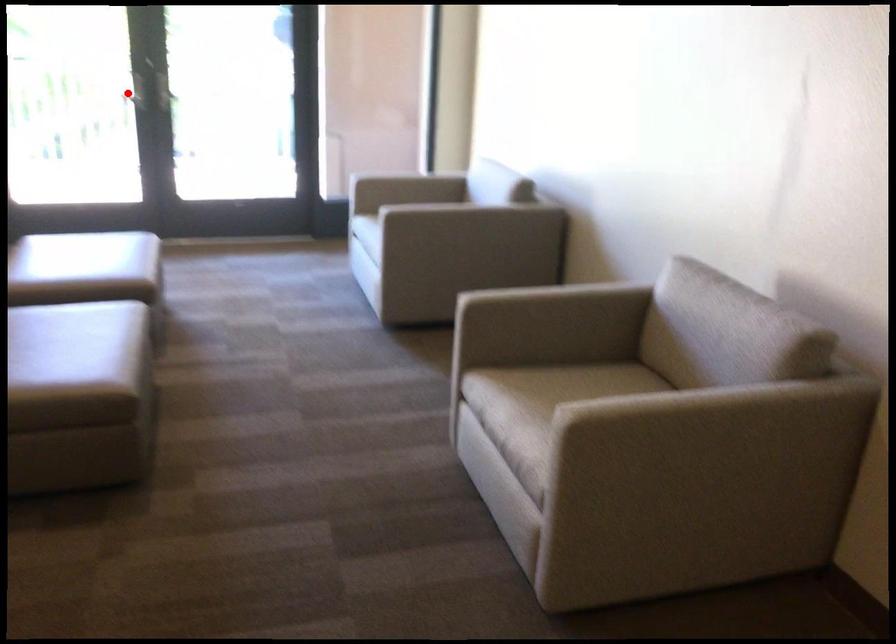
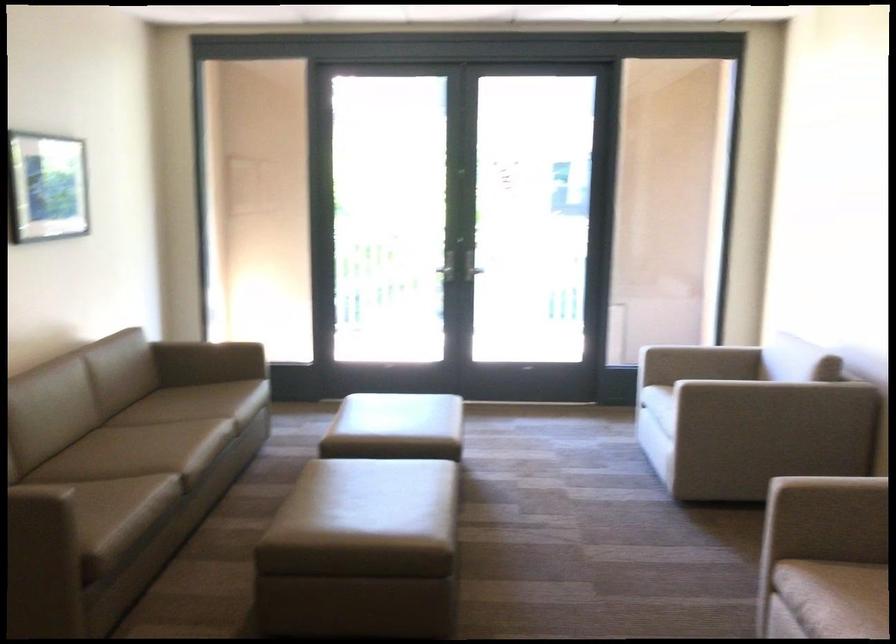
Question: I am providing you with two images of the same scene from different viewpoints. In image1, a red point is highlighted. Considering the same 3D point in image2, which of the following is correct?

Choices:
 (A) It is closer
 (B) It is farther

Answer: (B)